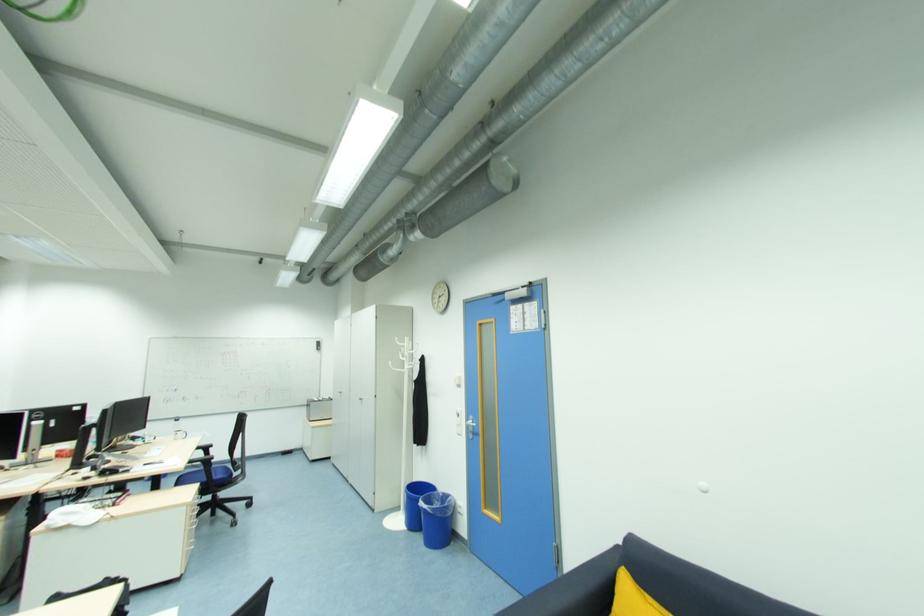
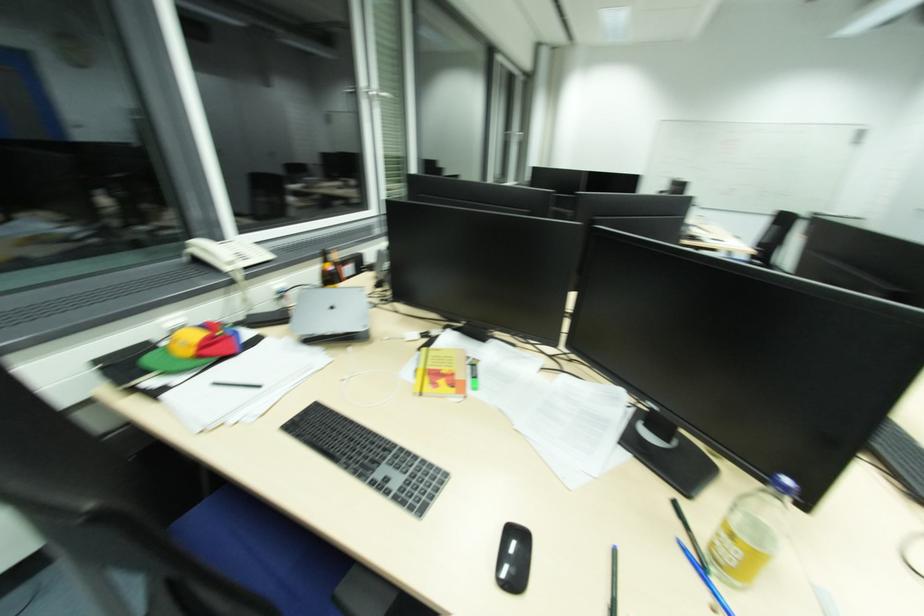
Question: I am providing you with two images of the same scene from different viewpoints. Which of the following objects are not visible in image2?

Choices:
 (A) black chair armrest
 (B) colorful propeller cap
 (C) black chair back top rail
 (D) white and blue booklet

Answer: (A)